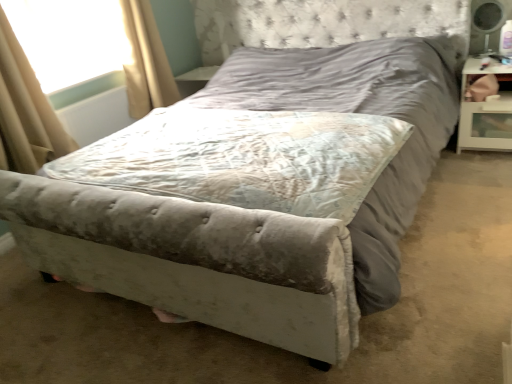
Question: Considering the relative sizes of beige fabric curtain at upper left, positioned as the second curtain in front-to-back order, and velvet gray mattress at center in the image provided, is beige fabric curtain at upper left, positioned as the second curtain in front-to-back order, shorter than velvet gray mattress at center?

Choices:
 (A) yes
 (B) no

Answer: (B)

Question: Would you consider beige fabric curtain at upper left, the 1th curtain positioned from the back, to be distant from velvet gray mattress at center?

Choices:
 (A) yes
 (B) no

Answer: (A)

Question: Is beige fabric curtain at upper left, the 1th curtain positioned from the back, outside of velvet gray mattress at center?

Choices:
 (A) yes
 (B) no

Answer: (A)

Question: From a real-world perspective, is beige fabric curtain at upper left, the 1th curtain positioned from the back, positioned over velvet gray mattress at center based on gravity?

Choices:
 (A) yes
 (B) no

Answer: (A)

Question: Is beige fabric curtain at upper left, positioned as the second curtain in front-to-back order, positioned with its back to velvet gray mattress at center?

Choices:
 (A) no
 (B) yes

Answer: (A)

Question: Is beige fabric curtain at upper left, the first curtain positioned from the right, facing towards velvet gray mattress at center?

Choices:
 (A) yes
 (B) no

Answer: (B)

Question: From the image's perspective, is velvet gray mattress at center above beige fabric curtain at upper left, the 1th curtain positioned from the back?

Choices:
 (A) no
 (B) yes

Answer: (A)

Question: Considering the relative sizes of velvet gray mattress at center and beige fabric curtain at upper left, the 1th curtain positioned from the back, in the image provided, is velvet gray mattress at center thinner than beige fabric curtain at upper left, the 1th curtain positioned from the back,?

Choices:
 (A) yes
 (B) no

Answer: (B)

Question: Is velvet gray mattress at center positioned with its back to beige fabric curtain at upper left, positioned as the second curtain in front-to-back order?

Choices:
 (A) yes
 (B) no

Answer: (B)

Question: Is velvet gray mattress at center located outside beige fabric curtain at upper left, positioned as the second curtain in front-to-back order?

Choices:
 (A) yes
 (B) no

Answer: (A)

Question: Is velvet gray mattress at center bigger than beige fabric curtain at upper left, the 1th curtain positioned from the back?

Choices:
 (A) yes
 (B) no

Answer: (A)

Question: Does velvet gray mattress at center have a greater width compared to beige fabric curtain at upper left, positioned as the second curtain in front-to-back order?

Choices:
 (A) yes
 (B) no

Answer: (A)

Question: Is transparent plastic window screen at upper left completely or partially outside of velvet gray mattress at center?

Choices:
 (A) no
 (B) yes

Answer: (B)